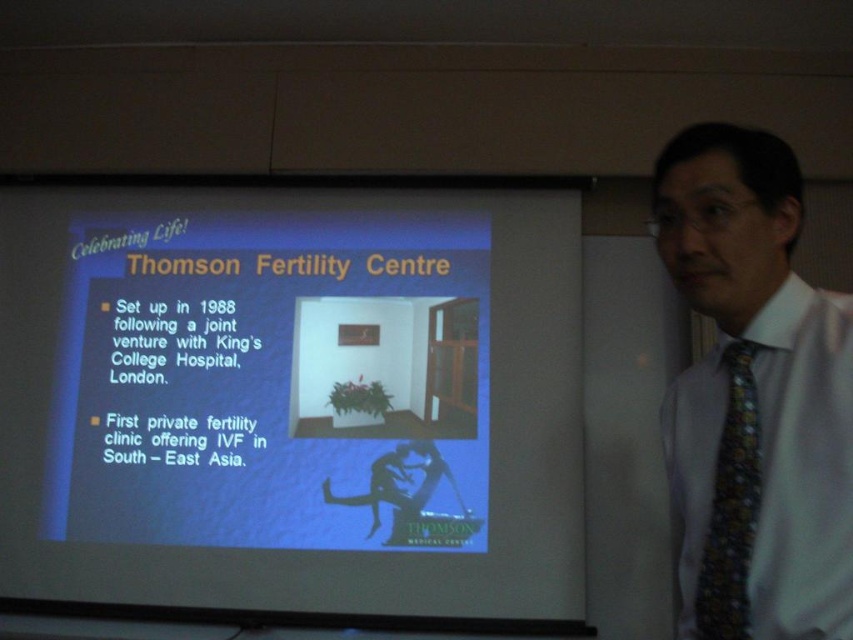
Does white silk shirt at right have a lesser width compared to multicolored patterned tie at right?

In fact, white silk shirt at right might be wider than multicolored patterned tie at right.

Measure the distance between white silk shirt at right and multicolored patterned tie at right.

2.60 inches

This screenshot has height=640, width=853. Describe the element at coordinates (753, 397) in the screenshot. I see `white silk shirt at right` at that location.

Identify the location of white silk shirt at right. The height and width of the screenshot is (640, 853). (753, 397).

Based on the photo, who is more distant from viewer, (346, 401) or (782, 330)?

The point (346, 401) is more distant.

Is blue matte screen at center in front of white silk shirt at right?

No, blue matte screen at center is further to the viewer.

The width and height of the screenshot is (853, 640). What do you see at coordinates (292, 401) in the screenshot? I see `blue matte screen at center` at bounding box center [292, 401].

The width and height of the screenshot is (853, 640). Identify the location of blue matte screen at center. (292, 401).

Between point (424, 362) and point (712, 515), which one is positioned behind?

The point (424, 362) is behind.

From the picture: Is blue matte screen at center shorter than multicolored patterned tie at right?

No.

What do you see at coordinates (292, 401) in the screenshot? I see `blue matte screen at center` at bounding box center [292, 401].

What are the coordinates of `blue matte screen at center` in the screenshot? It's located at (292, 401).